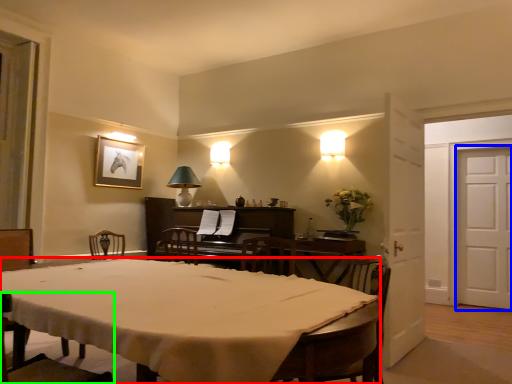
Question: Which object is positioned closest to desk (highlighted by a red box)? Select from door (highlighted by a blue box) and chair (highlighted by a green box).

Choices:
 (A) door
 (B) chair

Answer: (B)